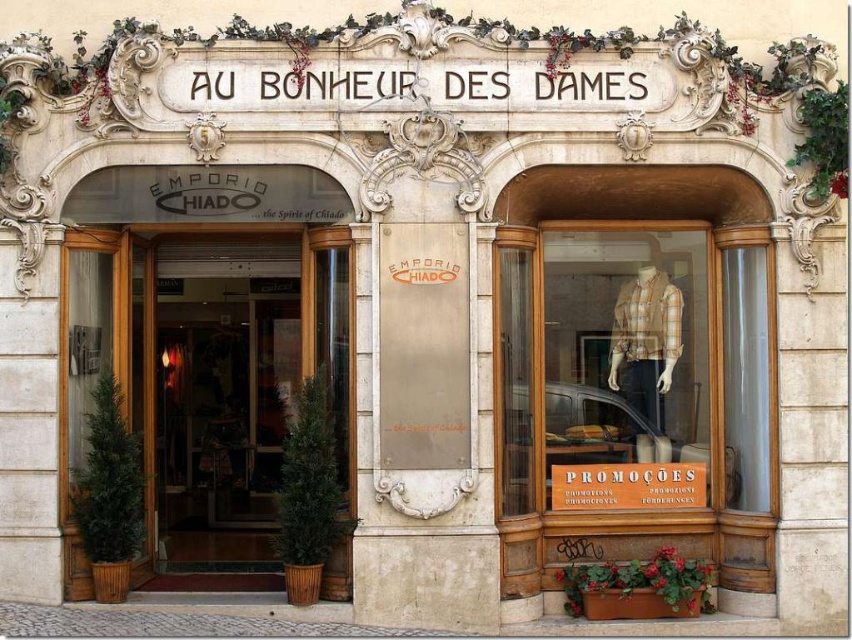
Is wooden mannequin at center positioned before green glossy door at center?

No, it is not.

Based on the photo, measure the distance between wooden mannequin at center and camera.

A distance of 9.09 meters exists between wooden mannequin at center and camera.

The image size is (852, 640). I want to click on wooden mannequin at center, so pos(634,365).